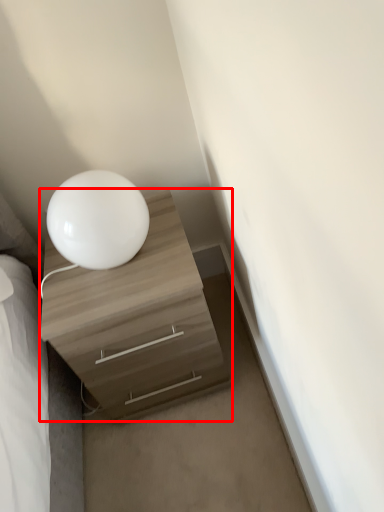
Question: Considering the relative positions of chest of drawers (annotated by the red box) and table lamp in the image provided, where is chest of drawers (annotated by the red box) located with respect to the staircase?

Choices:
 (A) right
 (B) left

Answer: (A)